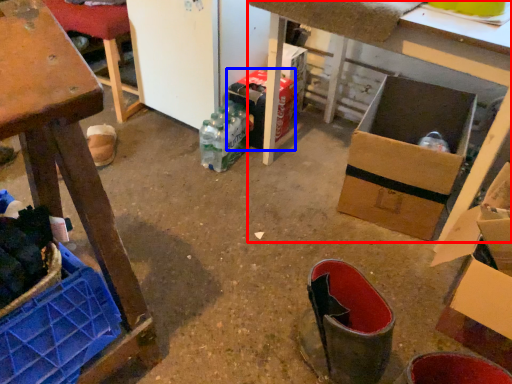
Question: Which of the following is the farthest to the observer, table (highlighted by a red box) or cardboard box (highlighted by a blue box)?

Choices:
 (A) table
 (B) cardboard box

Answer: (B)